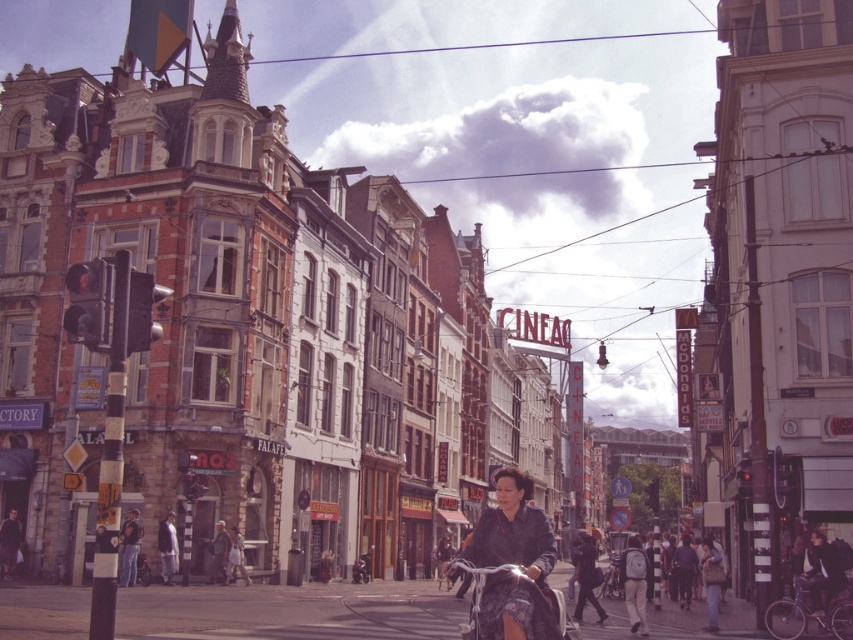
Question: Which of the following is the farthest from the observer?

Choices:
 (A) (167, 545)
 (B) (802, 611)

Answer: (A)

Question: Does shiny metallic bicycle at lower right have a smaller size compared to dark blue jeans at center?

Choices:
 (A) no
 (B) yes

Answer: (B)

Question: Is dark blue fabric jacket at center to the left of dark blue jeans at center from the viewer's perspective?

Choices:
 (A) no
 (B) yes

Answer: (B)

Question: Is dark blue fabric jacket at center above dark blue jacket at center?

Choices:
 (A) no
 (B) yes

Answer: (A)

Question: Estimate the real-world distances between objects in this image. Which object is farther from the dark blue fabric jacket at center?

Choices:
 (A) dark blue jeans at center
 (B) shiny metallic bicycle at lower right
 (C) dark blue jacket at center

Answer: (A)

Question: Which of the following is the farthest from the observer?

Choices:
 (A) shiny metallic bicycle at lower right
 (B) dark blue jeans at center

Answer: (B)